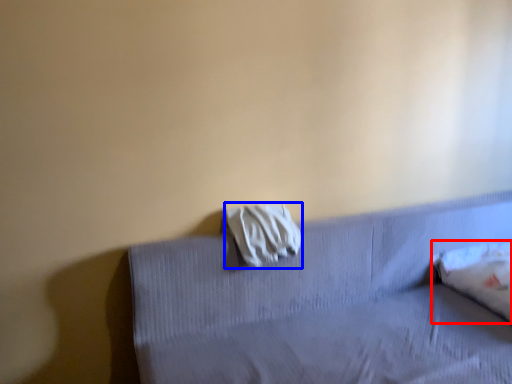
Question: Among these objects, which one is farthest to the camera, pillow (highlighted by a red box) or material (highlighted by a blue box)?

Choices:
 (A) pillow
 (B) material

Answer: (A)